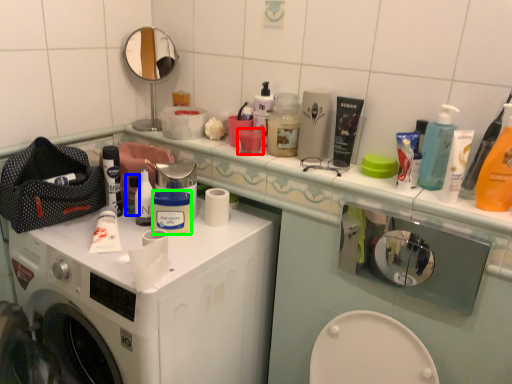
Question: Considering the real-world distances, which object is closest to mouthwash (highlighted by a red box)? toiletry (highlighted by a blue box) or mouthwash (highlighted by a green box).

Choices:
 (A) toiletry
 (B) mouthwash

Answer: (B)